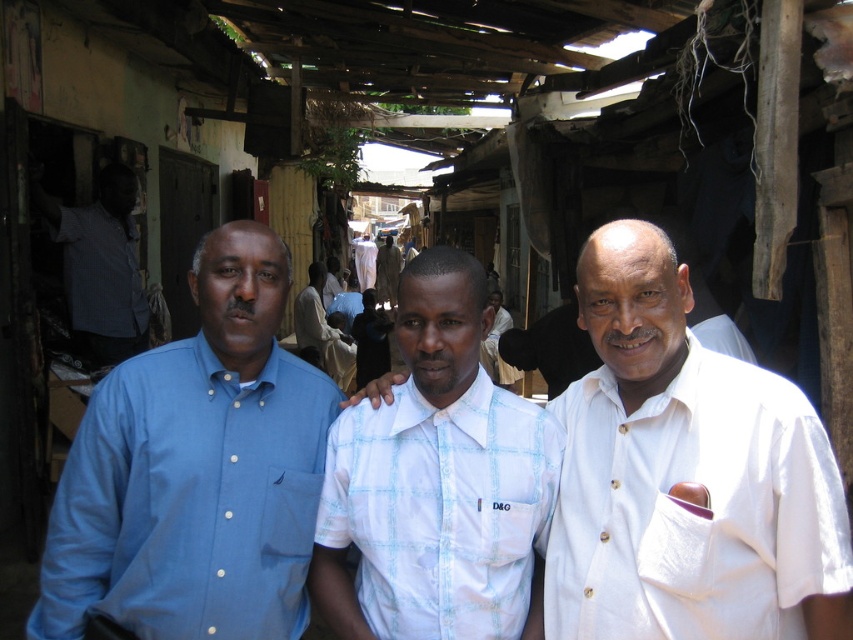
Can you confirm if white checkered shirt at center is wider than blue shirt at left?

Yes.

Can you confirm if white checkered shirt at center is smaller than blue shirt at left?

Correct, white checkered shirt at center occupies less space than blue shirt at left.

At what (x,y) coordinates should I click in order to perform the action: click on white checkered shirt at center. Please return your answer as a coordinate pair (x, y). Image resolution: width=853 pixels, height=640 pixels. Looking at the image, I should click on (440, 509).

Is matte blue shirt at left bigger than white cotton shirt at center?

Yes.

Who is higher up, matte blue shirt at left or white cotton shirt at center?

white cotton shirt at center is higher up.

Locate an element on the screen. The height and width of the screenshot is (640, 853). matte blue shirt at left is located at coordinates (196, 470).

Which is below, white cotton shirt at center or blue shirt at left?

white cotton shirt at center is lower down.

This screenshot has height=640, width=853. What do you see at coordinates (682, 438) in the screenshot? I see `white cotton shirt at center` at bounding box center [682, 438].

In order to click on white cotton shirt at center in this screenshot , I will do `click(682, 438)`.